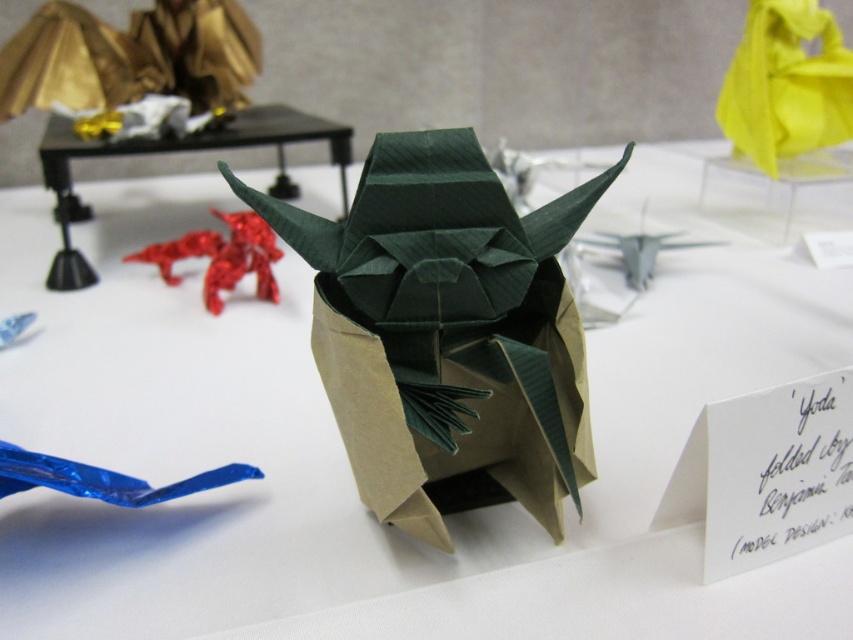
Can you confirm if black plastic table at upper center is positioned to the left of white paper at center?

Correct, you'll find black plastic table at upper center to the left of white paper at center.

Identify the location of black plastic table at upper center. The width and height of the screenshot is (853, 640). (177, 150).

What do you see at coordinates (177, 150) in the screenshot?
I see `black plastic table at upper center` at bounding box center [177, 150].

You are a GUI agent. You are given a task and a screenshot of the screen. Output one action in this format:
    pyautogui.click(x=<x>, y=<y>)
    Task: Click on the black plastic table at upper center
    The image size is (853, 640).
    Given the screenshot: What is the action you would take?
    pyautogui.click(x=177, y=150)

Can you confirm if yellow paper bag at upper right is positioned to the left of white paper at center?

Yes, yellow paper bag at upper right is to the left of white paper at center.

Between yellow paper bag at upper right and white paper at center, which one has more height?

Standing taller between the two is yellow paper bag at upper right.

Is point (805, 8) closer to camera compared to point (819, 234)?

That is False.

This screenshot has height=640, width=853. Identify the location of yellow paper bag at upper right. (786, 84).

Is yellow paper bag at upper right closer to the viewer compared to black plastic table at upper center?

No, it is behind black plastic table at upper center.

Is yellow paper bag at upper right smaller than black plastic table at upper center?

Yes.

Which is behind, point (816, 88) or point (48, 124)?

Point (48, 124)

Where is `yellow paper bag at upper right`? The height and width of the screenshot is (640, 853). yellow paper bag at upper right is located at coordinates (786, 84).